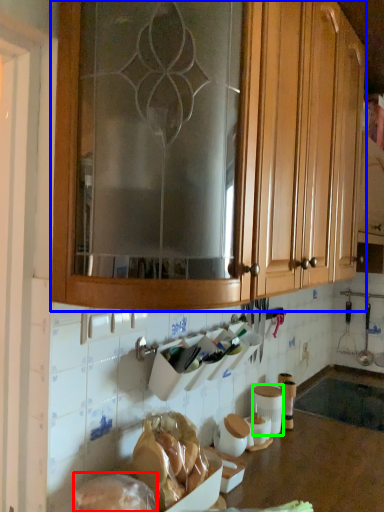
Question: Based on their relative distances, which object is nearer to food (highlighted by a red box)? Choose from cabinetry (highlighted by a blue box) and pottery (highlighted by a green box).

Choices:
 (A) cabinetry
 (B) pottery

Answer: (B)